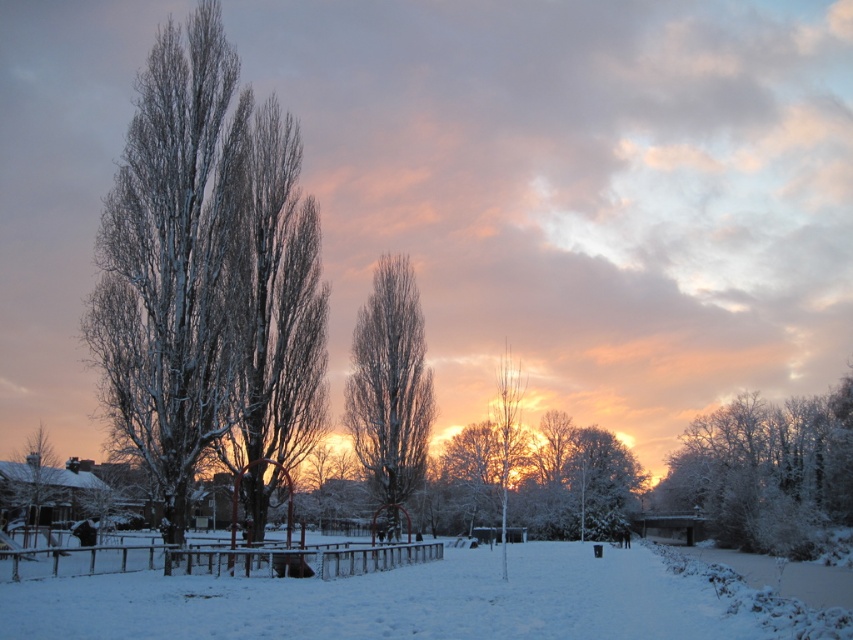
You are standing at the point marked as point (599, 483) in the winter scene. What is the object you are standing on?

The point (599, 483) is on white snow covered tree at center, so you are standing on a white snow covered tree at center.